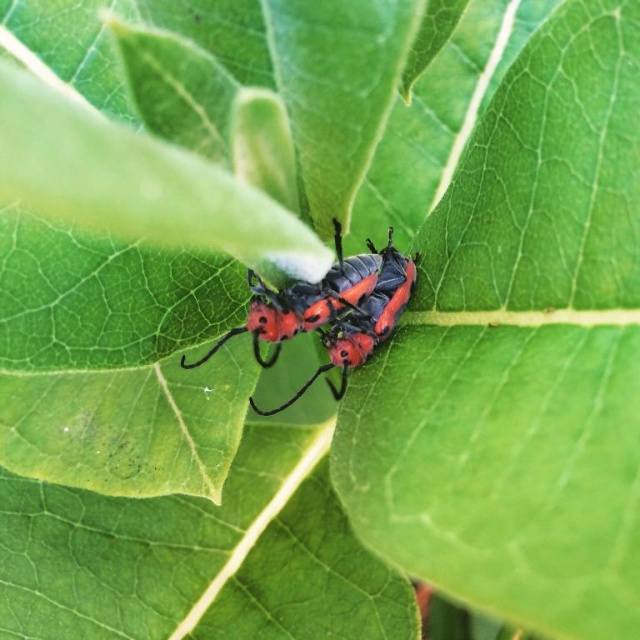
You are an entomologist observing the scene. You need to determine the relative positions of the green matte leaf at center and the shiny red beetle at center. Which object is positioned to the right of the other?

The green matte leaf at center is to the right of the shiny red beetle at center, so the shiny red beetle at center is to the left of the green matte leaf at center.

You are an entomologist observing the green matte leaf at center and the shiny red beetle at center. From your vantage point, which object is closer to you?

The green matte leaf at center is closer to you because it is in front of the shiny red beetle at center.